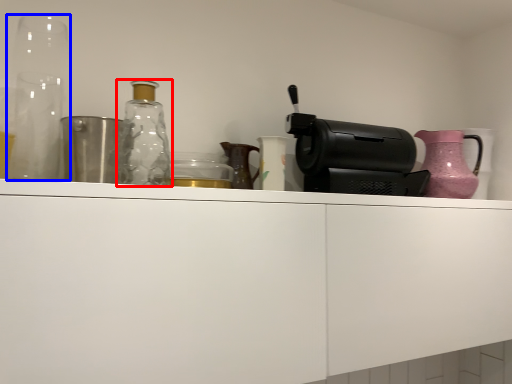
Question: Among these objects, which one is nearest to the camera, bottle (highlighted by a red box) or glass vase (highlighted by a blue box)?

Choices:
 (A) bottle
 (B) glass vase

Answer: (B)